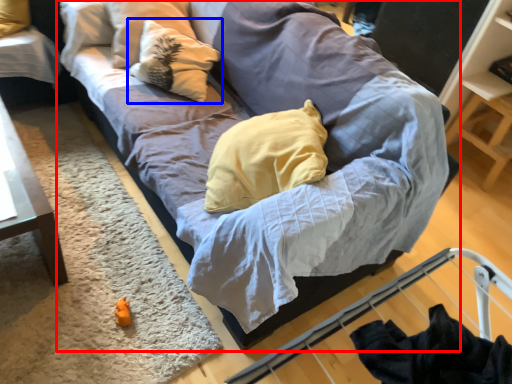
Question: Which object appears farthest to the camera in this image, studio couch (highlighted by a red box) or pillow (highlighted by a blue box)?

Choices:
 (A) studio couch
 (B) pillow

Answer: (B)